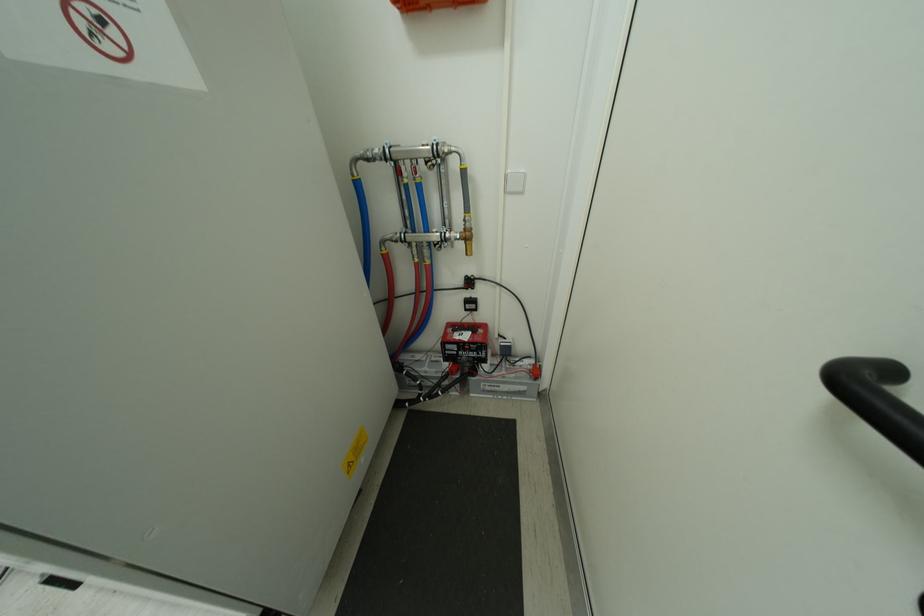
Where would you push the white light switch? Please return your answer as a coordinate pair (x, y).

(515, 182)